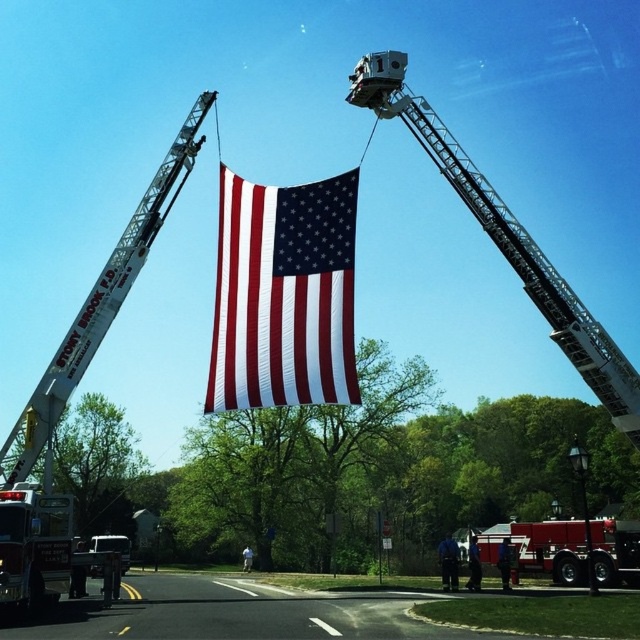
Consider the image. Does green painted metal streetlight at lower right come in front of metallic silver lift at center?

Yes, it is.

Who is shorter, green painted metal streetlight at lower right or metallic silver lift at center?

With less height is metallic silver lift at center.

Locate an element on the screen. green painted metal streetlight at lower right is located at coordinates (582, 508).

This screenshot has width=640, height=640. Find the location of `green painted metal streetlight at lower right`. green painted metal streetlight at lower right is located at coordinates (582, 508).

Is point (45, 429) more distant than point (566, 580)?

No.

Is white metallic fire truck at left wider than red glossy fire truck at center?

No, white metallic fire truck at left is not wider than red glossy fire truck at center.

At what (x,y) coordinates should I click in order to perform the action: click on white metallic fire truck at left. Please return your answer as a coordinate pair (x, y). The image size is (640, 640). Looking at the image, I should click on 72,392.

Does white metallic fire truck at left come in front of metallic silver ladder at upper center?

Yes, white metallic fire truck at left is closer to the viewer.

Which is behind, point (168, 177) or point (518, 273)?

Point (518, 273)

Find the location of a particular element. This screenshot has width=640, height=640. white metallic fire truck at left is located at coordinates point(72,392).